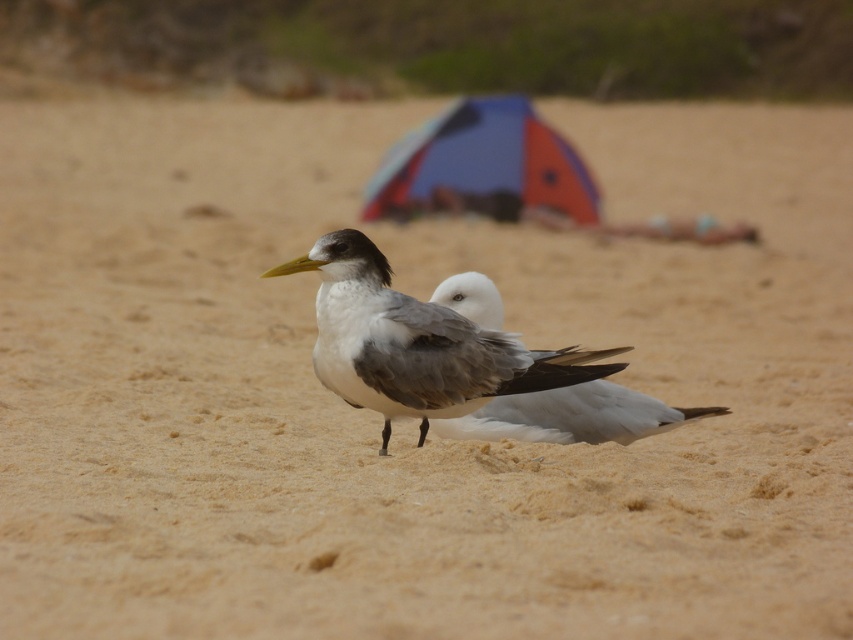
Question: Which object is closer to the camera taking this photo?

Choices:
 (A) blue fabric tent at center
 (B) gray matte gull at center

Answer: (B)

Question: Is blue fabric tent at center above white matte bird at center?

Choices:
 (A) yes
 (B) no

Answer: (A)

Question: Which point is farther to the camera?

Choices:
 (A) (500, 157)
 (B) (525, 372)

Answer: (A)

Question: Which point appears farthest from the camera in this image?

Choices:
 (A) (469, 305)
 (B) (386, 348)
 (C) (514, 131)

Answer: (C)

Question: Does gray matte gull at center appear on the right side of white matte bird at center?

Choices:
 (A) yes
 (B) no

Answer: (B)

Question: Can you confirm if gray matte gull at center is positioned below white matte bird at center?

Choices:
 (A) no
 (B) yes

Answer: (A)